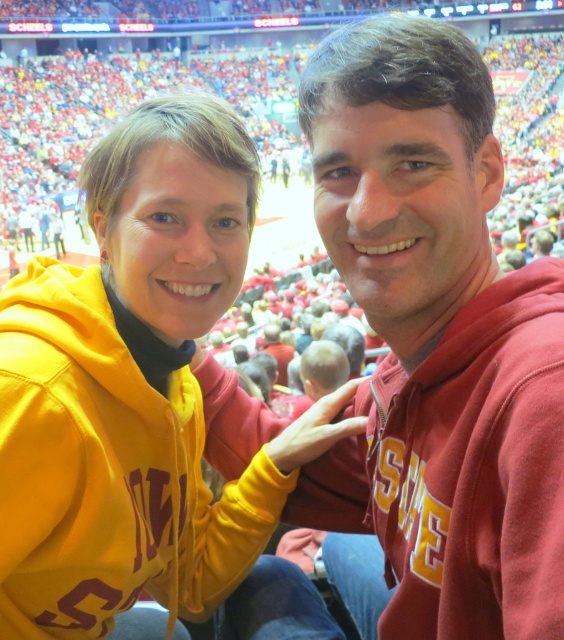
Consider the image. Does matte yellow hoodie at center have a greater width compared to matte red hoodie at center?

Indeed, matte yellow hoodie at center has a greater width compared to matte red hoodie at center.

Does point (23, 480) come farther from viewer compared to point (334, 90)?

That is False.

Between point (271, 518) and point (399, 396), which one is positioned in front?

Point (399, 396) is more forward.

Find the location of a particular element. Image resolution: width=564 pixels, height=640 pixels. matte yellow hoodie at center is located at coordinates (143, 404).